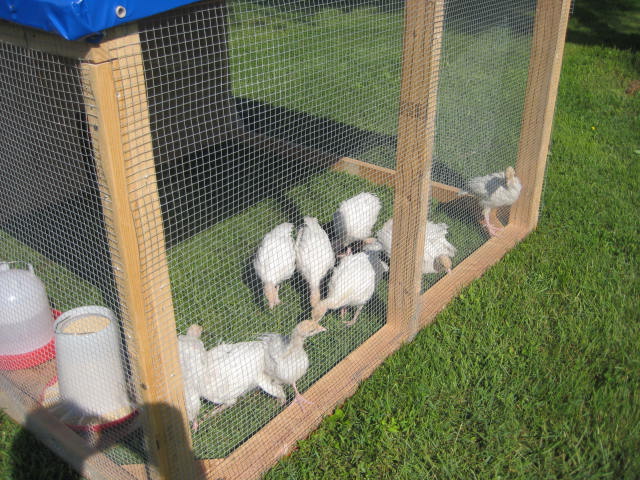
Find the location of a particular element. The height and width of the screenshot is (480, 640). feeding dish is located at coordinates (102, 380).